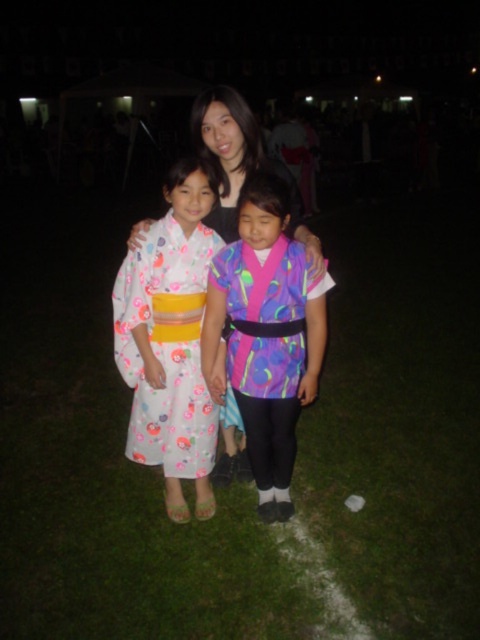
Question: Does floral silk kimono at center have a greater width compared to matte black kimono at center?

Choices:
 (A) yes
 (B) no

Answer: (B)

Question: Among these points, which one is farthest from the camera?

Choices:
 (A) (295, 193)
 (B) (213, 554)
 (C) (217, 396)

Answer: (A)

Question: Which point is closer to the camera?

Choices:
 (A) (267, 472)
 (B) (132, 291)

Answer: (B)

Question: Which object is the closest to the green grass at center?

Choices:
 (A) neon fabric kimono at center
 (B) matte black kimono at center
 (C) floral silk kimono at center

Answer: (A)

Question: Is green grass at center positioned before neon fabric kimono at center?

Choices:
 (A) yes
 (B) no

Answer: (A)

Question: Can you confirm if green grass at center is wider than floral silk kimono at center?

Choices:
 (A) yes
 (B) no

Answer: (A)